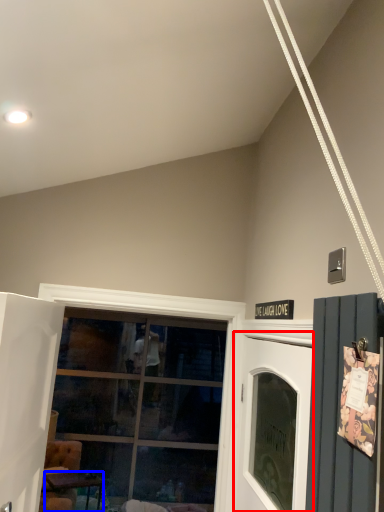
Question: Among these objects, which one is farthest to the camera, garage door (highlighted by a red box) or table (highlighted by a blue box)?

Choices:
 (A) garage door
 (B) table

Answer: (B)